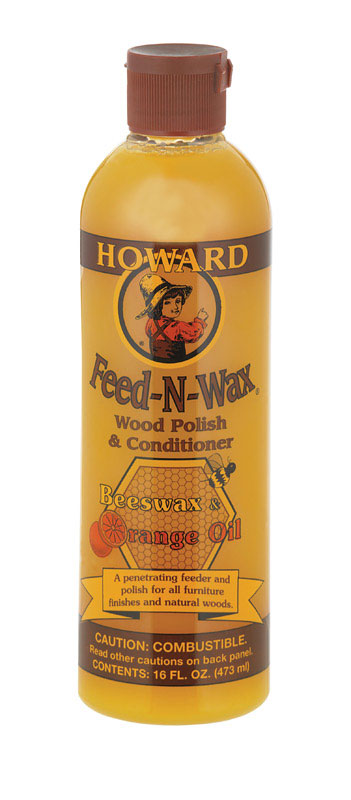
Find the location of a particular element. bottle is located at coordinates (217, 194).